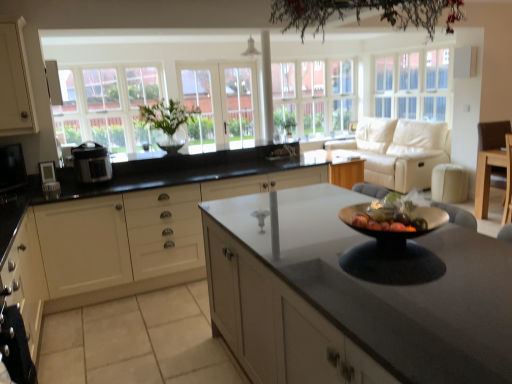
What do you see at coordinates (26, 280) in the screenshot?
I see `matte black stove at lower left, the second cabinetry in the left-to-right sequence` at bounding box center [26, 280].

Measure the distance between point (443, 126) and camera.

Point (443, 126) is 5.15 meters away from camera.

Locate an element on the screen. Image resolution: width=512 pixels, height=384 pixels. clear glass window at center, which is the second window from left to right is located at coordinates (x=315, y=96).

What do you see at coordinates (91, 163) in the screenshot?
I see `satin black pressure cooker at left, the second appliance when ordered from left to right` at bounding box center [91, 163].

This screenshot has width=512, height=384. I want to click on white matte cabinet at left, the third cabinetry in the right-to-left sequence, so click(x=15, y=82).

Find the location of a particular element. Image resolution: width=512 pixels, height=384 pixels. matte black stove at lower left, the second cabinetry in the left-to-right sequence is located at coordinates (26, 280).

Looking at this image, which is behind, light brown wood chair at right or green leafy plant at center?

green leafy plant at center is more distant.

What's the angular difference between light brown wood chair at right and green leafy plant at center's facing directions?

The angle between the facing direction of light brown wood chair at right and the facing direction of green leafy plant at center is 7.77 degrees.

The width and height of the screenshot is (512, 384). Identify the location of armchair below the green leafy plant at center (from a real-world perspective). (489, 161).

From their relative heights in the image, would you say light brown wood chair at right is taller or shorter than green leafy plant at center?

In the image, light brown wood chair at right appears to be taller than green leafy plant at center.

Between green leafy plant at center and matte black microwave at left, positioned as the second appliance in right-to-left order, which one appears on the right side from the viewer's perspective?

From the viewer's perspective, green leafy plant at center appears more on the right side.

Is matte black microwave at left, the 1th appliance when ordered from left to right, surrounded by green leafy plant at center?

No.

How much distance is there between green leafy plant at center and matte black microwave at left, positioned as the second appliance in right-to-left order?

green leafy plant at center and matte black microwave at left, positioned as the second appliance in right-to-left order, are 4.18 feet apart from each other.

Is green leafy plant at center turned away from matte black microwave at left, positioned as the second appliance in right-to-left order?

No, green leafy plant at center is not facing away from matte black microwave at left, positioned as the second appliance in right-to-left order.

Is white matte cabinet at center, acting as the 1th cabinetry starting from the right, at the back of white matte cabinet at left, the third cabinetry in the right-to-left sequence?

white matte cabinet at left, the third cabinetry in the right-to-left sequence, is not turned away from white matte cabinet at center, acting as the 1th cabinetry starting from the right.

From the image's perspective, is white matte cabinet at left, the third cabinetry in the right-to-left sequence, positioned above or below white matte cabinet at center, the 3th cabinetry from the left?

Clearly, from the image's perspective, white matte cabinet at left, the third cabinetry in the right-to-left sequence, is above white matte cabinet at center, the 3th cabinetry from the left.

Does white matte cabinet at left, the third cabinetry in the right-to-left sequence, have a greater height compared to white matte cabinet at center, acting as the 1th cabinetry starting from the right?

No, white matte cabinet at left, the third cabinetry in the right-to-left sequence, is not taller than white matte cabinet at center, acting as the 1th cabinetry starting from the right.

Does white glass window at left, positioned as the 1th window in left-to-right order, have a lesser width compared to white glass window at upper right, acting as the 1th window starting from the right?

Indeed, white glass window at left, positioned as the 1th window in left-to-right order, has a lesser width compared to white glass window at upper right, acting as the 1th window starting from the right.

Which is more to the right, white glass window at left, positioned as the 1th window in left-to-right order, or white glass window at upper right, acting as the 1th window starting from the right?

Positioned to the right is white glass window at upper right, acting as the 1th window starting from the right.

Which of these two, white glass window at left, arranged as the third window when viewed from the right, or white glass window at upper right, acting as the 1th window starting from the right, is bigger?

With larger size is white glass window at upper right, acting as the 1th window starting from the right.

Is white glass window at left, arranged as the third window when viewed from the right, inside or outside of white glass window at upper right, acting as the 1th window starting from the right?

white glass window at left, arranged as the third window when viewed from the right, exists outside the volume of white glass window at upper right, acting as the 1th window starting from the right.

Can we say matte black microwave at left, the 1th appliance when ordered from left to right, lies outside green leafy plant at center?

That's correct, matte black microwave at left, the 1th appliance when ordered from left to right, is outside of green leafy plant at center.

Locate an element on the screen. houseplant to the right of matte black microwave at left, the 1th appliance when ordered from left to right is located at coordinates click(167, 122).

Is matte black microwave at left, positioned as the second appliance in right-to-left order, bigger or smaller than green leafy plant at center?

Considering their sizes, matte black microwave at left, positioned as the second appliance in right-to-left order, takes up less space than green leafy plant at center.

Considering the relative positions of matte black microwave at left, the 1th appliance when ordered from left to right, and green leafy plant at center in the image provided, is matte black microwave at left, the 1th appliance when ordered from left to right, to the right of green leafy plant at center from the viewer's perspective?

No.

Between white glass window at left, positioned as the 1th window in left-to-right order, and green leafy plant at center, which one has larger size?

With larger size is white glass window at left, positioned as the 1th window in left-to-right order.

Is white glass window at left, arranged as the third window when viewed from the right, not near green leafy plant at center?

Yes, white glass window at left, arranged as the third window when viewed from the right, and green leafy plant at center are quite far apart.

Would you say white glass window at left, positioned as the 1th window in left-to-right order, is outside green leafy plant at center?

Absolutely, white glass window at left, positioned as the 1th window in left-to-right order, is external to green leafy plant at center.

Is white glass door at center, which is the first glass door from left to right, completely or partially outside of clear glass window at center, which is the second window from left to right?

Yes, white glass door at center, which is the first glass door from left to right, is outside of clear glass window at center, which is the second window from left to right.

Are white glass door at center, the second glass door positioned from the right, and clear glass window at center, marked as the 2th window in a right-to-left arrangement, located far from each other?

No.

Is white glass door at center, which is the first glass door from left to right, to the left or to the right of clear glass window at center, marked as the 2th window in a right-to-left arrangement, in the image?

white glass door at center, which is the first glass door from left to right, is to the left of clear glass window at center, marked as the 2th window in a right-to-left arrangement.

Where is `plant above the light brown wood chair at right (from a real-world perspective)`? Image resolution: width=512 pixels, height=384 pixels. plant above the light brown wood chair at right (from a real-world perspective) is located at coordinates (285, 119).

Where is `appliance that is the 1st object directly below the green leafy plant at center (from a real-world perspective)`? The height and width of the screenshot is (384, 512). appliance that is the 1st object directly below the green leafy plant at center (from a real-world perspective) is located at coordinates (12, 168).

In the scene shown: Looking at the image, which one is located further to white matte cabinet at center, acting as the 1th cabinetry starting from the right, white glass window at left, arranged as the third window when viewed from the right, or matte black stove at lower left, the second cabinetry in the left-to-right sequence?

Based on the image, white glass window at left, arranged as the third window when viewed from the right, appears to be further to white matte cabinet at center, acting as the 1th cabinetry starting from the right.

Based on their spatial positions, is clear glass door at center, which is counted as the second glass door, starting from the left, or white glass window at left, positioned as the 1th window in left-to-right order, further from beige leather couch at upper right?

Among the two, white glass window at left, positioned as the 1th window in left-to-right order, is located further to beige leather couch at upper right.

From the image, which object appears to be nearer to matte black microwave at left, positioned as the second appliance in right-to-left order, beige leather couch at upper right or green leafy plant at center?

Based on the image, green leafy plant at center appears to be nearer to matte black microwave at left, positioned as the second appliance in right-to-left order.

Looking at the image, which one is located closer to beige leather couch at upper right, matte black stove at lower left, positioned as the second cabinetry in right-to-left order, or green leafy plant at center?

green leafy plant at center lies closer to beige leather couch at upper right than the other object.

Considering their positions, is beige leather couch at upper right positioned closer to green leafy plant at center than clear glass door at center, which is the 1th glass door from right to left?

The object closer to green leafy plant at center is clear glass door at center, which is the 1th glass door from right to left.

From the image, which object appears to be nearer to white glass window at upper right, which is the third window in left-to-right order, beige leather couch at upper right or clear glass door at center, which is counted as the second glass door, starting from the left?

beige leather couch at upper right is closer to white glass window at upper right, which is the third window in left-to-right order.

Considering their positions, is matte black stove at lower left, the second cabinetry in the left-to-right sequence, positioned closer to green leafy plant at center than clear glass window at center, marked as the 2th window in a right-to-left arrangement?

matte black stove at lower left, the second cabinetry in the left-to-right sequence.

Estimate the real-world distances between objects in this image. Which object is further from matte black stove at lower left, the second cabinetry in the left-to-right sequence, white glass door at center, which is the first glass door from left to right, or clear glass door at center, which is the 1th glass door from right to left?

Based on the image, clear glass door at center, which is the 1th glass door from right to left, appears to be further to matte black stove at lower left, the second cabinetry in the left-to-right sequence.

Identify the location of studio couch situated between satin black pressure cooker at left, the 1th appliance positioned from the right, and white glass window at upper right, which is the third window in left-to-right order, from left to right. This screenshot has width=512, height=384. (399, 151).

Where is `fruit dish between matte black stove at lower left, the second cabinetry in the left-to-right sequence, and white glass window at left, positioned as the 1th window in left-to-right order, along the z-axis`? This screenshot has width=512, height=384. fruit dish between matte black stove at lower left, the second cabinetry in the left-to-right sequence, and white glass window at left, positioned as the 1th window in left-to-right order, along the z-axis is located at coordinates (391, 215).

Locate an element on the screen. houseplant located between white matte cabinet at left, the third cabinetry in the right-to-left sequence, and white glass window at left, positioned as the 1th window in left-to-right order, in the depth direction is located at coordinates (167, 122).

Locate an element on the screen. This screenshot has height=384, width=512. appliance that lies between white matte cabinet at left, the 1th cabinetry positioned from the left, and matte black microwave at left, positioned as the second appliance in right-to-left order, from top to bottom is located at coordinates (91, 163).